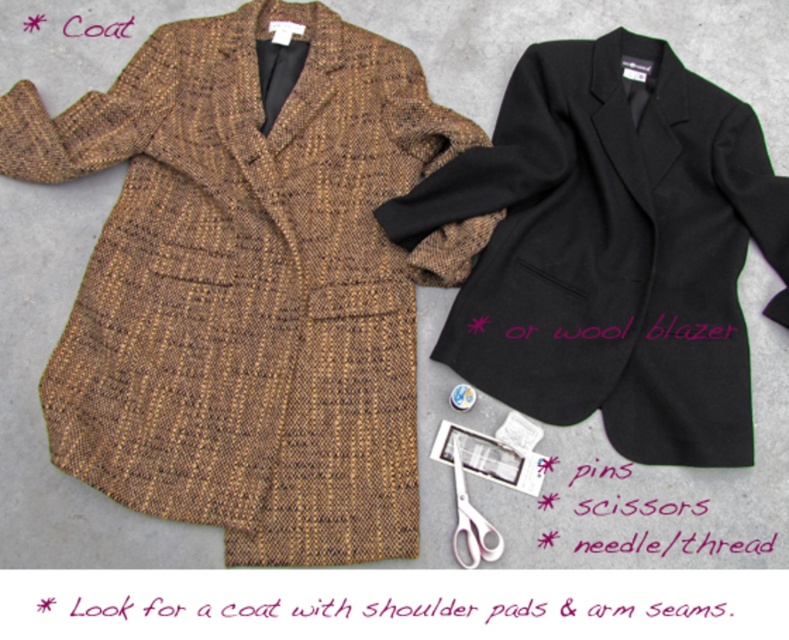
Does black wool blazer at upper right appear on the right side of pink plastic scissors at lower center?

Yes, black wool blazer at upper right is to the right of pink plastic scissors at lower center.

Is the position of black wool blazer at upper right less distant than that of pink plastic scissors at lower center?

Yes, black wool blazer at upper right is in front of pink plastic scissors at lower center.

Does point (442, 192) come closer to viewer compared to point (458, 525)?

No, it is behind (458, 525).

You are a GUI agent. You are given a task and a screenshot of the screen. Output one action in this format:
    pyautogui.click(x=<x>, y=<y>)
    Task: Click on the black wool blazer at upper right
    This screenshot has width=789, height=640.
    Given the screenshot: What is the action you would take?
    pyautogui.click(x=612, y=248)

Is brown tweed coat at upper left to the right of black wool blazer at upper right from the viewer's perspective?

No, brown tweed coat at upper left is not to the right of black wool blazer at upper right.

Who is shorter, brown tweed coat at upper left or black wool blazer at upper right?

black wool blazer at upper right

Which is in front, point (230, 477) or point (597, 326)?

Point (230, 477)

Find the location of a particular element. brown tweed coat at upper left is located at coordinates (249, 284).

Can you confirm if brown tweed coat at upper left is bigger than pink plastic scissors at lower center?

Yes.

Can you confirm if brown tweed coat at upper left is shorter than pink plastic scissors at lower center?

In fact, brown tweed coat at upper left may be taller than pink plastic scissors at lower center.

Is point (152, 397) behind point (457, 465)?

That is False.

At what (x,y) coordinates should I click in order to perform the action: click on brown tweed coat at upper left. Please return your answer as a coordinate pair (x, y). This screenshot has height=640, width=789. Looking at the image, I should click on (249, 284).